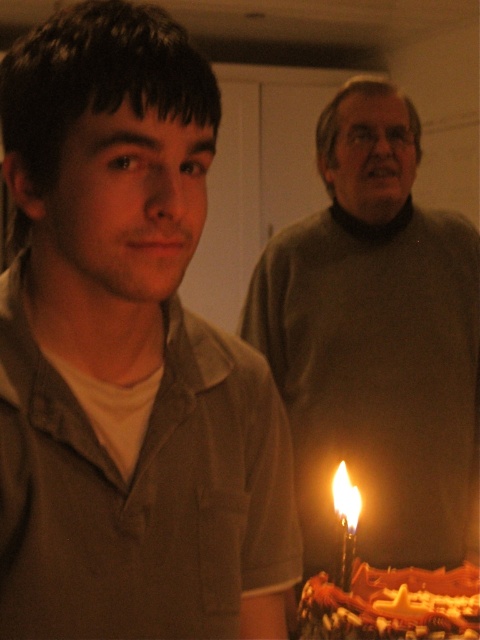
You are an interior designer analyzing the lighting in this room. The candle on the cake in the lower right corner is the only light source. Where would you place a matte brown shirt at center to ensure it is fully illuminated by the candlelight?

The matte brown shirt at center should be placed at point (127, 355) to ensure it is fully illuminated by the candlelight.